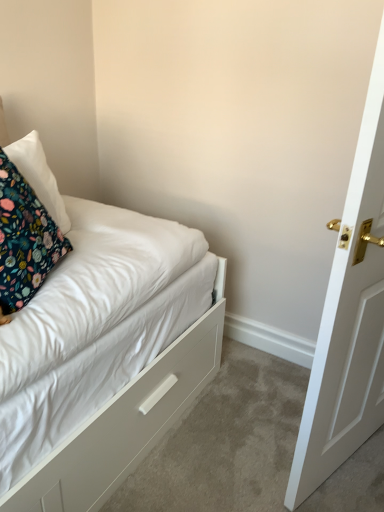
Locate an element on the screen. vacant region above white matte drawer at lower left (from a real-world perspective) is located at coordinates click(x=235, y=430).